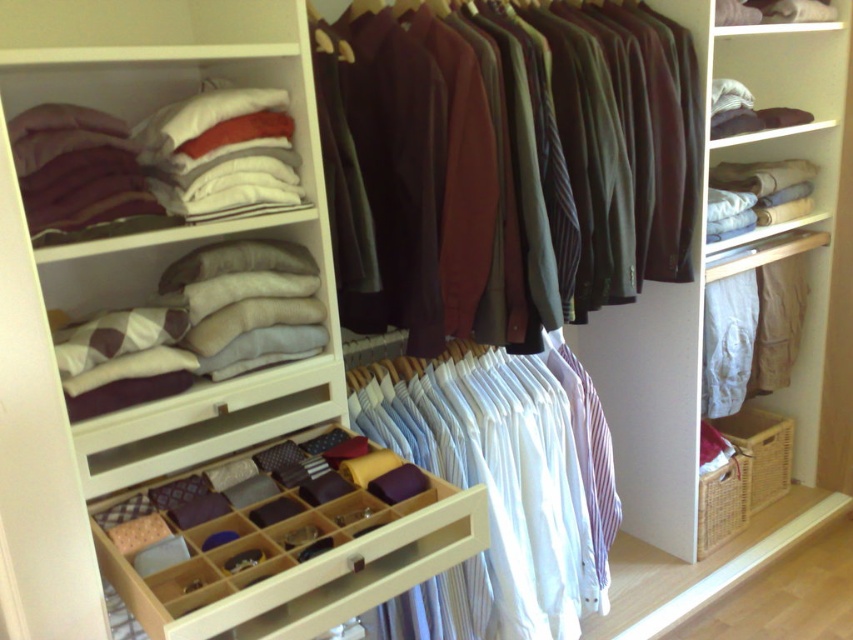
Question: Does dark brown wool sweaters at center come in front of white cotton shirts at center?

Choices:
 (A) yes
 (B) no

Answer: (A)

Question: Which point is closer to the camera?

Choices:
 (A) wooden tie organizer at center
 (B) dark brown wool sweaters at center

Answer: (A)

Question: Does dark brown wool sweaters at center have a greater width compared to wooden tie organizer at center?

Choices:
 (A) yes
 (B) no

Answer: (A)

Question: Is dark brown wool sweaters at center smaller than wooden tie organizer at center?

Choices:
 (A) no
 (B) yes

Answer: (A)

Question: Based on their relative distances, which object is nearer to the white cotton shirts at center?

Choices:
 (A) dark brown wool sweaters at center
 (B) wooden tie organizer at center

Answer: (A)

Question: Which is nearer to the dark brown wool sweaters at center?

Choices:
 (A) wooden tie organizer at center
 (B) white cotton shirts at center

Answer: (B)